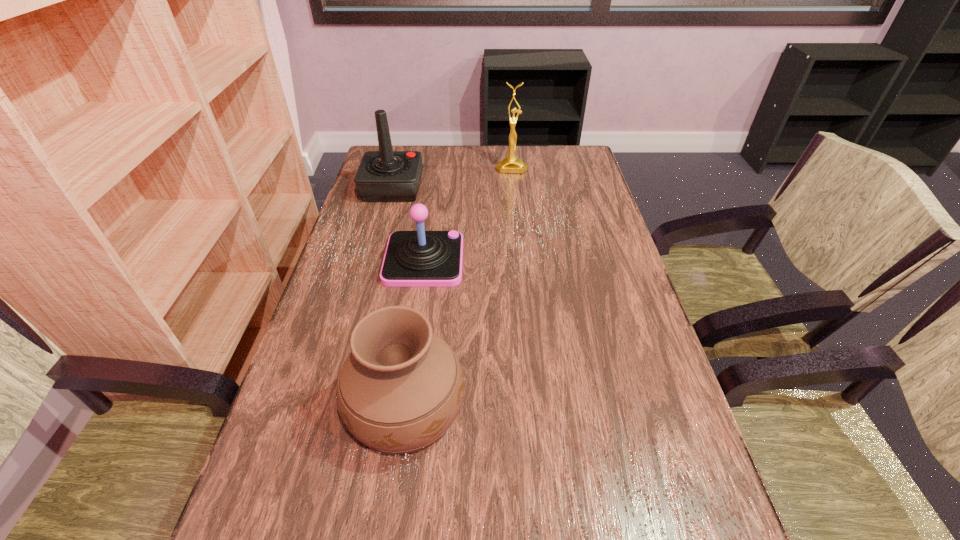
The height and width of the screenshot is (540, 960). Find the location of `vacant space that satisfies the following two spatial constraints: 1. on the front-facing side of the rightmost object; 2. on the front-facing side of the taller joystick`. vacant space that satisfies the following two spatial constraints: 1. on the front-facing side of the rightmost object; 2. on the front-facing side of the taller joystick is located at coordinates (514, 188).

Where is `free point that satisfies the following two spatial constraints: 1. on the front-facing side of the nearest object; 2. on the left side of the farther joystick`? This screenshot has width=960, height=540. free point that satisfies the following two spatial constraints: 1. on the front-facing side of the nearest object; 2. on the left side of the farther joystick is located at coordinates (333, 406).

You are a GUI agent. You are given a task and a screenshot of the screen. Output one action in this format:
    pyautogui.click(x=<x>, y=<y>)
    Task: Click on the vacant space that satisfies the following two spatial constraints: 1. on the front-facing side of the rightmost object; 2. forward from the base of the nearer joystick
    This screenshot has height=540, width=960.
    Given the screenshot: What is the action you would take?
    pyautogui.click(x=521, y=260)